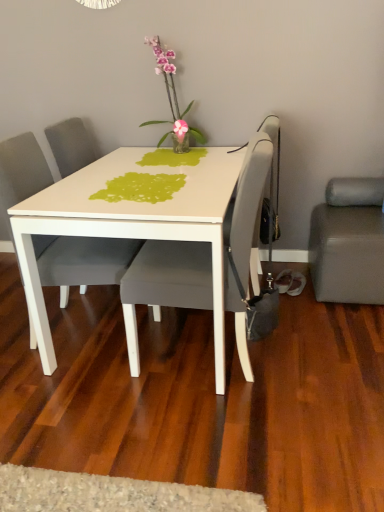
In order to click on space that is in front of matte gray chair at center, which appears as the 2th chair when viewed from the right in this screenshot , I will do `click(69, 401)`.